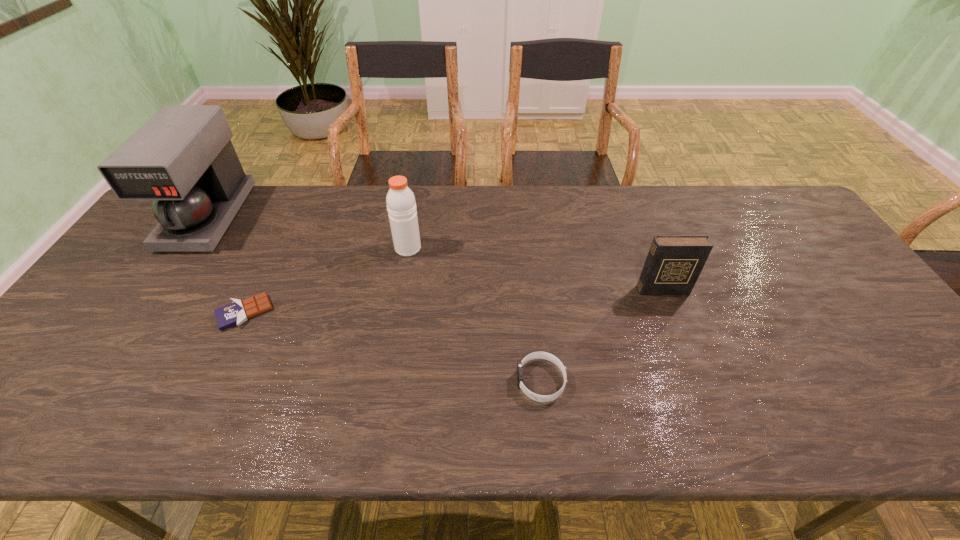
Identify the location of the tallest object. (182, 158).

Locate an element on the screen. the leftmost object is located at coordinates (x=182, y=158).

The width and height of the screenshot is (960, 540). What are the coordinates of `shaker` in the screenshot? It's located at (401, 205).

Locate an element on the screen. Image resolution: width=960 pixels, height=540 pixels. the third object from right to left is located at coordinates (401, 205).

Identify the location of the third shortest object. (674, 262).

I want to click on diary, so click(x=674, y=262).

What are the coordinates of `the second object from right to left` in the screenshot? It's located at (535, 355).

What are the coordinates of `the second shortest object` in the screenshot? It's located at (535, 355).

The image size is (960, 540). What are the coordinates of `the shortest object` in the screenshot? It's located at (237, 312).

The width and height of the screenshot is (960, 540). I want to click on the fourth object from right to left, so click(237, 312).